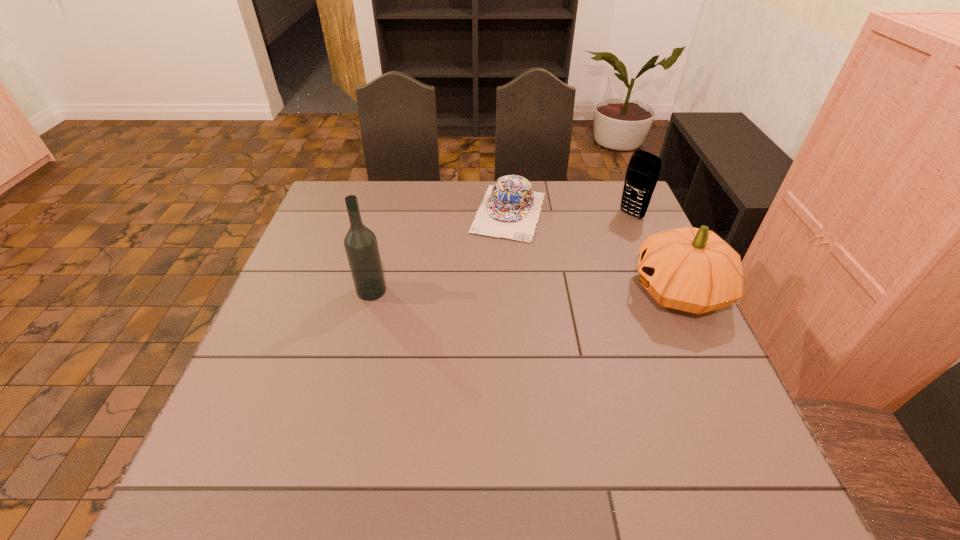
You are a GUI agent. You are given a task and a screenshot of the screen. Output one action in this format:
    pyautogui.click(x=<x>, y=<y>)
    Task: Click on the free region located 0.310m on the screen of the cellular telephone
    The width and height of the screenshot is (960, 540).
    Given the screenshot: What is the action you would take?
    pyautogui.click(x=558, y=266)

Where is `free region located on the screen of the cellular telephone`? free region located on the screen of the cellular telephone is located at coordinates (589, 244).

I want to click on free region located on the screen of the cellular telephone, so click(535, 282).

Find the location of a particular element. The height and width of the screenshot is (540, 960). vacant space situated 0.270m on the front, side, and top of the cap is located at coordinates (477, 310).

The height and width of the screenshot is (540, 960). Identify the location of vacant space located 0.250m on the front, side, and top of the cap. (479, 305).

This screenshot has width=960, height=540. Identify the location of free region located on the front, side, and top of the cap. (473, 322).

Locate an element on the screen. cellular telephone situated at the far edge is located at coordinates (642, 174).

Identify the location of cap that is at the far edge. This screenshot has width=960, height=540. (511, 208).

Where is `gourd that is positioned at the right edge`? This screenshot has width=960, height=540. gourd that is positioned at the right edge is located at coordinates (691, 269).

Image resolution: width=960 pixels, height=540 pixels. Find the location of `cellular telephone that is positioned at the right edge`. cellular telephone that is positioned at the right edge is located at coordinates (642, 174).